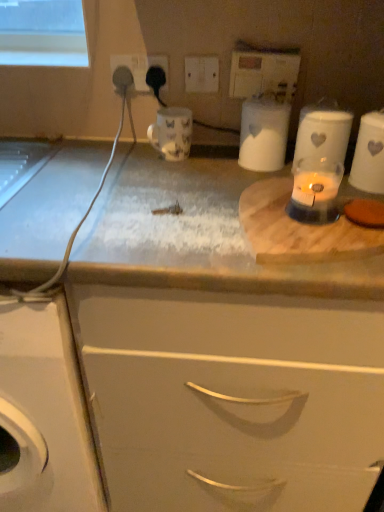
You are a GUI agent. You are given a task and a screenshot of the screen. Output one action in this format:
    pyautogui.click(x=<x>, y=<y>)
    Task: Click on the vacant space that is in between white matte container at upper center, which is the second appliance from left to right, and matte ceramic mug at center, which is counted as the first appliance, starting from the left
    Image resolution: width=384 pixels, height=512 pixels.
    Given the screenshot: What is the action you would take?
    pyautogui.click(x=213, y=162)